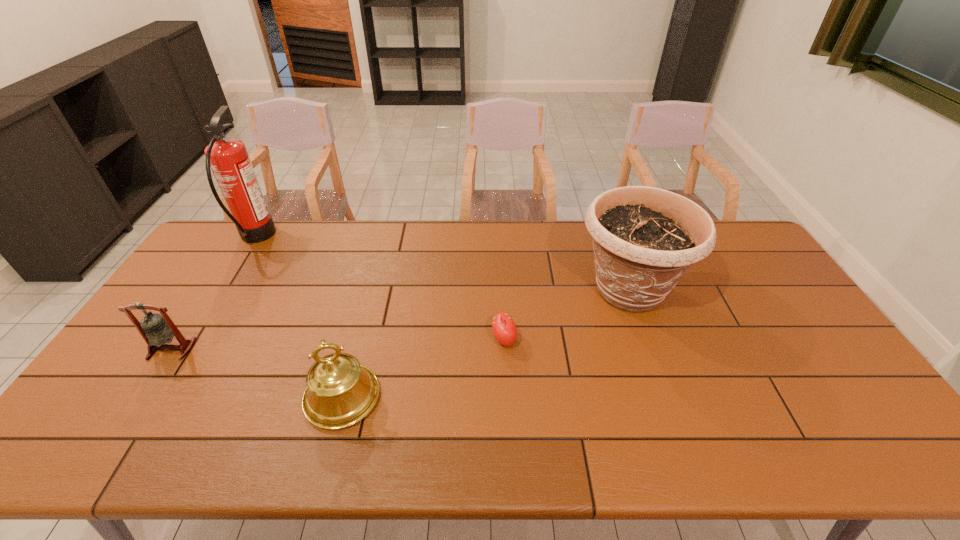
Find the location of a particular element. The image size is (960, 540). vacant region at the far edge of the desktop is located at coordinates click(x=330, y=238).

Where is `free space at the near edge of the desktop`? Image resolution: width=960 pixels, height=540 pixels. free space at the near edge of the desktop is located at coordinates (734, 441).

What are the coordinates of `free region at the left edge of the desktop` in the screenshot? It's located at (129, 376).

Find the location of `free region at the far left corner of the desktop`. free region at the far left corner of the desktop is located at coordinates (229, 254).

Image resolution: width=960 pixels, height=540 pixels. I want to click on free region at the near left corner, so click(62, 458).

The height and width of the screenshot is (540, 960). What are the coordinates of `free area in between the rightmost object and the apple` in the screenshot? It's located at (566, 315).

Find the location of a particular element. This screenshot has height=540, width=960. free space between the second tallest object and the apple is located at coordinates (566, 315).

Identify the location of free space that is in between the nearest object and the tallest object. click(299, 318).

Find the location of a particular element. The width and height of the screenshot is (960, 540). vacant area between the fire extinguisher and the third object from left to right is located at coordinates (299, 318).

Where is `free space between the tallest object and the shorter bell`? The height and width of the screenshot is (540, 960). free space between the tallest object and the shorter bell is located at coordinates (214, 293).